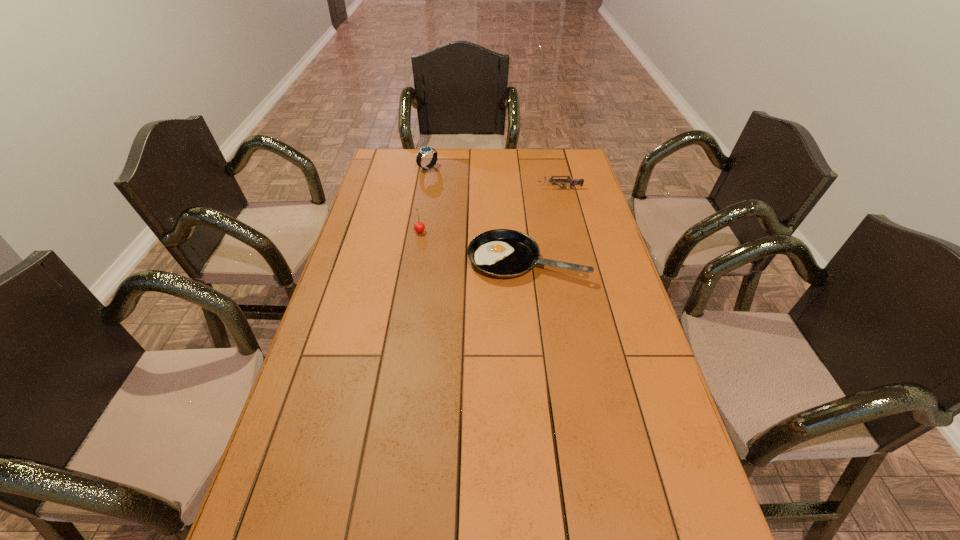
Identify the location of object at the far edge. Image resolution: width=960 pixels, height=540 pixels. (424, 151).

What are the coordinates of `gun that is at the right edge` in the screenshot? It's located at tap(572, 182).

The image size is (960, 540). I want to click on frying pan situated at the right edge, so click(503, 253).

Image resolution: width=960 pixels, height=540 pixels. Identify the location of vacant area at the far edge of the desktop. (439, 171).

This screenshot has width=960, height=540. In order to click on blank space at the left edge in this screenshot , I will do `click(411, 177)`.

Identify the location of free spot at the right edge of the desktop. Image resolution: width=960 pixels, height=540 pixels. (566, 249).

The height and width of the screenshot is (540, 960). In the image, there is a desktop. What are the coordinates of `blank space at the far left corner` in the screenshot? It's located at (396, 170).

The image size is (960, 540). I want to click on free location at the far right corner, so click(563, 173).

The width and height of the screenshot is (960, 540). I want to click on free space between the second farthest object and the watch, so click(x=494, y=178).

Identify the location of blank region between the second farthest object and the frying pan. Image resolution: width=960 pixels, height=540 pixels. (543, 224).